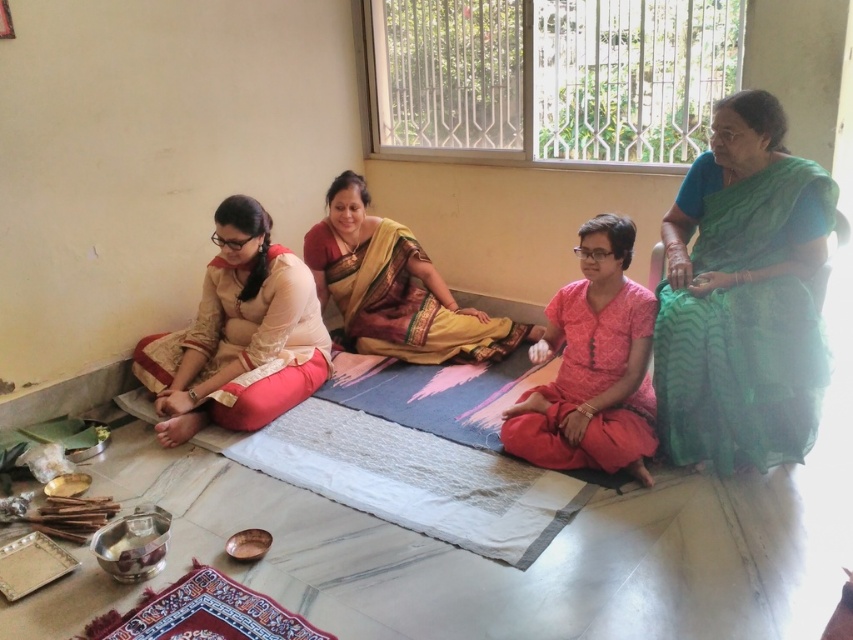
From the picture: Who is more forward, (630, 452) or (384, 256)?

Point (630, 452) is in front.

Between pink cotton kurta at center and brown silk saree at center, which one has more height?

With more height is pink cotton kurta at center.

This screenshot has width=853, height=640. What are the coordinates of `pink cotton kurta at center` in the screenshot? It's located at (592, 365).

Can you confirm if brown silk saree at center is shorter than embroidered silk mat at lower left?

No, brown silk saree at center is not shorter than embroidered silk mat at lower left.

Is brown silk saree at center further to the viewer compared to embroidered silk mat at lower left?

Yes, it is.

Is point (335, 227) farther from viewer compared to point (161, 592)?

Yes, it is.

Where is `brown silk saree at center`? The width and height of the screenshot is (853, 640). brown silk saree at center is located at coordinates (395, 289).

Is the position of green sheer saree at right less distant than that of embroidered silk mat at lower left?

That is False.

Is green sheer saree at right positioned at the back of embroidered silk mat at lower left?

Yes, it is behind embroidered silk mat at lower left.

Does point (788, 252) lie in front of point (90, 627)?

No, (788, 252) is behind (90, 627).

This screenshot has width=853, height=640. I want to click on green sheer saree at right, so click(x=741, y=296).